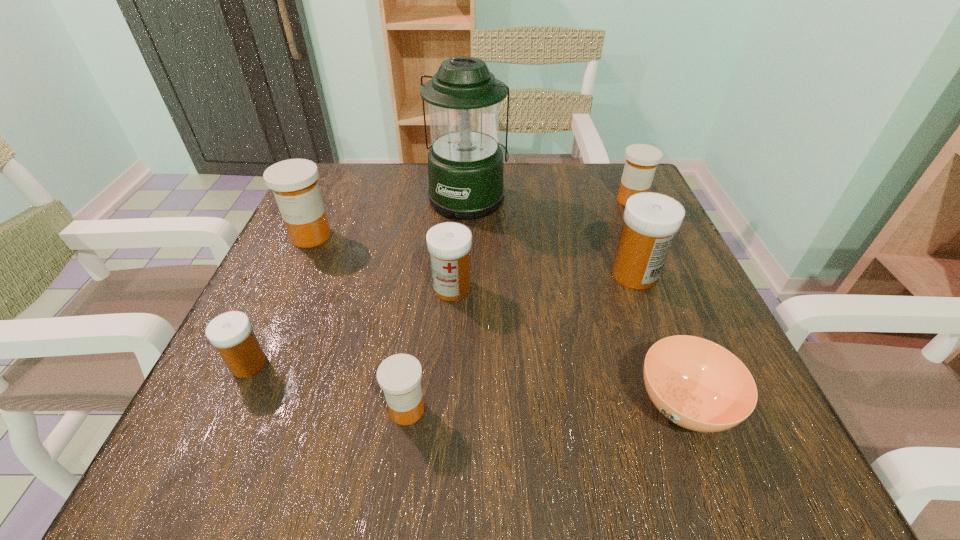
Locate an element on the screen. the second orange medicine from right to left is located at coordinates (399, 376).

Where is `the smallest orange medicine`? the smallest orange medicine is located at coordinates (399, 376).

This screenshot has width=960, height=540. What are the coordinates of `peach soup bowl` in the screenshot? It's located at (697, 384).

The width and height of the screenshot is (960, 540). What are the coordinates of `the shortest object` in the screenshot? It's located at (697, 384).

This screenshot has height=540, width=960. What are the coordinates of `vacant space located 0.170m on the left of the green lantern` in the screenshot? It's located at (355, 198).

Where is `free spot located on the label of the leftmost orange medicine`? This screenshot has width=960, height=540. free spot located on the label of the leftmost orange medicine is located at coordinates (260, 347).

Find the location of a particular element. This screenshot has height=540, width=960. vacant region located on the back of the rightmost white medicine is located at coordinates (612, 214).

The image size is (960, 540). Find the location of `free space located 0.320m on the label of the farthest orange medicine`. free space located 0.320m on the label of the farthest orange medicine is located at coordinates [474, 200].

Where is `free location located 0.340m on the label of the farthest orange medicine`? free location located 0.340m on the label of the farthest orange medicine is located at coordinates (466, 200).

Identify the location of free space located 0.350m on the label of the farthest orange medicine. The image size is (960, 540). 462,200.